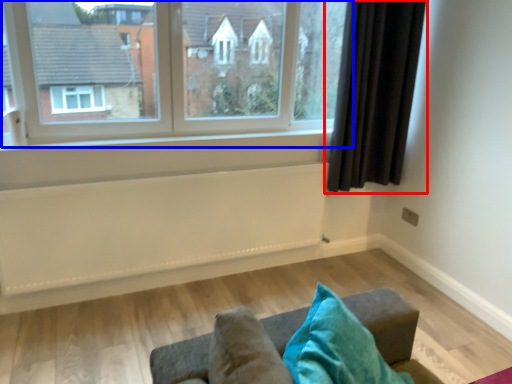
Question: Among these objects, which one is farthest to the camera, curtain (highlighted by a red box) or window (highlighted by a blue box)?

Choices:
 (A) curtain
 (B) window

Answer: (A)